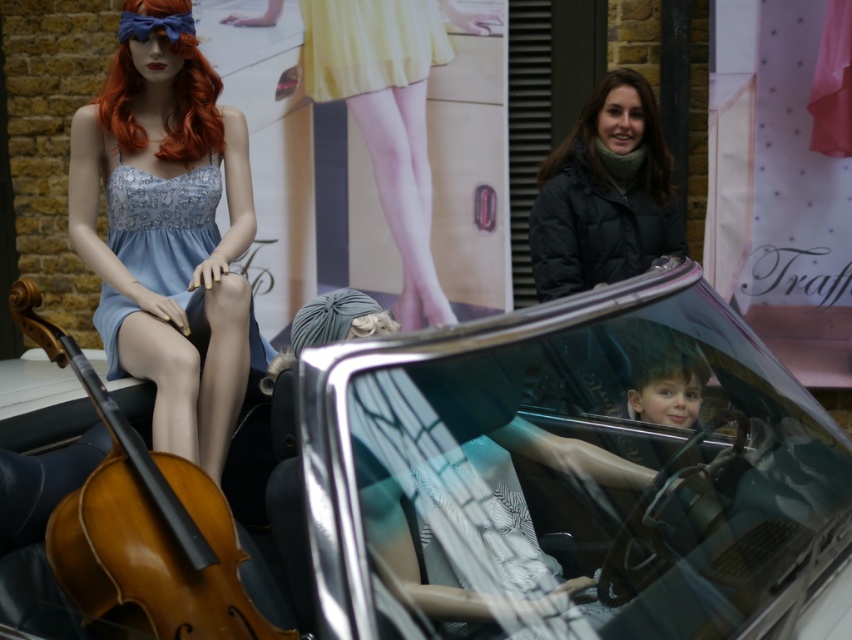
Question: Is matte blue dress at left wider than matte pink tights at center?

Choices:
 (A) no
 (B) yes

Answer: (A)

Question: Can you confirm if vivid orange wig at upper left is smaller than brown matte hair at upper center?

Choices:
 (A) no
 (B) yes

Answer: (B)

Question: Which point is farther to the camera?

Choices:
 (A) (453, 259)
 (B) (545, 164)

Answer: (A)

Question: Which object is closer to the camera taking this photo?

Choices:
 (A) light blue satin dress at left
 (B) black puffer jacket at upper right
 (C) yellow satin skirt at upper center

Answer: (A)

Question: Which object is positioned closest to the wooden violin at left?

Choices:
 (A) light blue satin dress at left
 (B) matte pink tights at center
 (C) gray fabric wig at center

Answer: (C)

Question: Can you confirm if shiny silver car at center is thinner than brown matte hair at upper center?

Choices:
 (A) yes
 (B) no

Answer: (B)